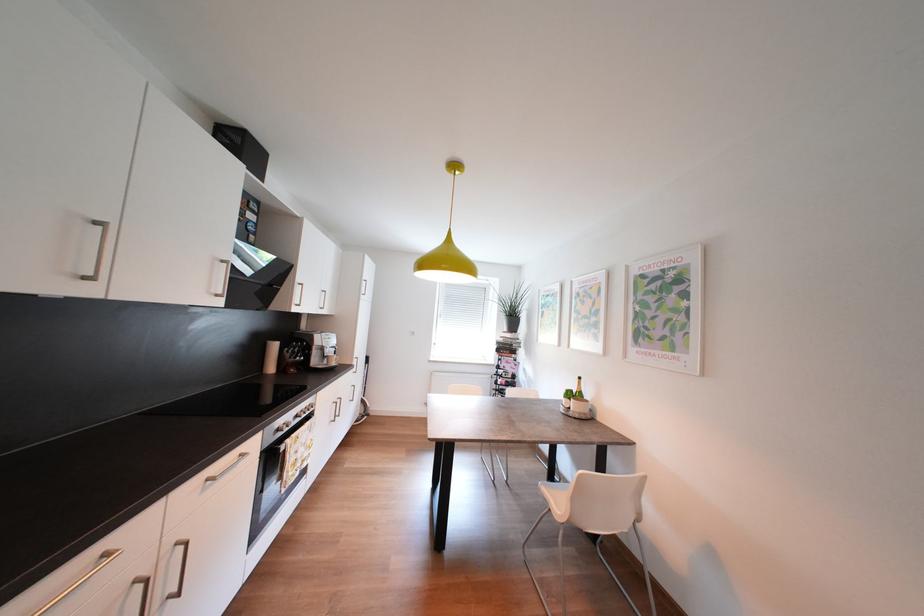
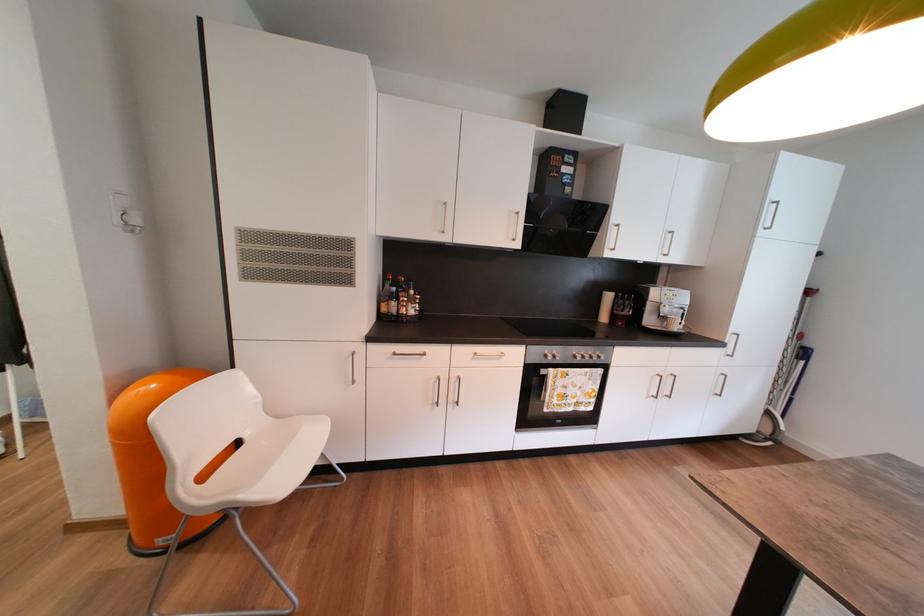
Question: The camera is either moving clockwise (left) or counter-clockwise (right) around the object. The first image is from the beginning of the video and the second image is from the end. Is the camera moving left or right when shooting the video?

Choices:
 (A) Left
 (B) Right

Answer: (B)